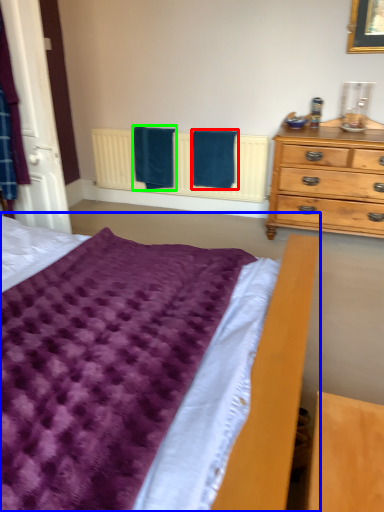
Question: Which is farther away from bath towel (highlighted by a red box)? bed (highlighted by a blue box) or bath towel (highlighted by a green box)?

Choices:
 (A) bed
 (B) bath towel

Answer: (A)